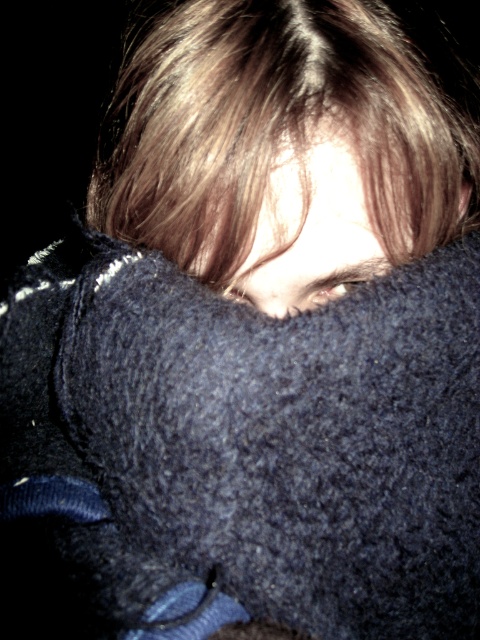
You are a photographer trying to capture the visible details of the smooth brown hair at center and the dark blue fuzzy head at center in the image. Since the background is black, you want to ensure proper exposure. Which object should you adjust your camera settings for first to ensure it is properly lit?

The dark blue fuzzy head at center is bigger than the smooth brown hair at center, so you should adjust the camera settings for the dark blue fuzzy head at center first to ensure its larger area is properly lit.

You are an artist trying to sketch this scene. You need to determine the order of the points to ensure proper layering. Which point should be drawn first, point (183, 237) or point (347, 140)?

Point (347, 140) should be drawn first because it is in front of point (183, 237), which is behind it.

You are taking a photo of a person with a camera. The person is wearing a dark blue fabric that covers most of their face except for one eye. You want to ensure the photo captures the texture of the fabric clearly. Given that the point at coordinates point (244, 42) is 13.08 inches away from the camera, should you adjust your camera position to be closer or farther away to achieve this?

The point at coordinates point (244, 42) is 13.08 inches away from the camera. To capture the texture of the fabric clearly, you should move the camera closer to the subject since the current distance is 13.08 inches, and getting closer would allow for a more detailed capture of the fabric texture.